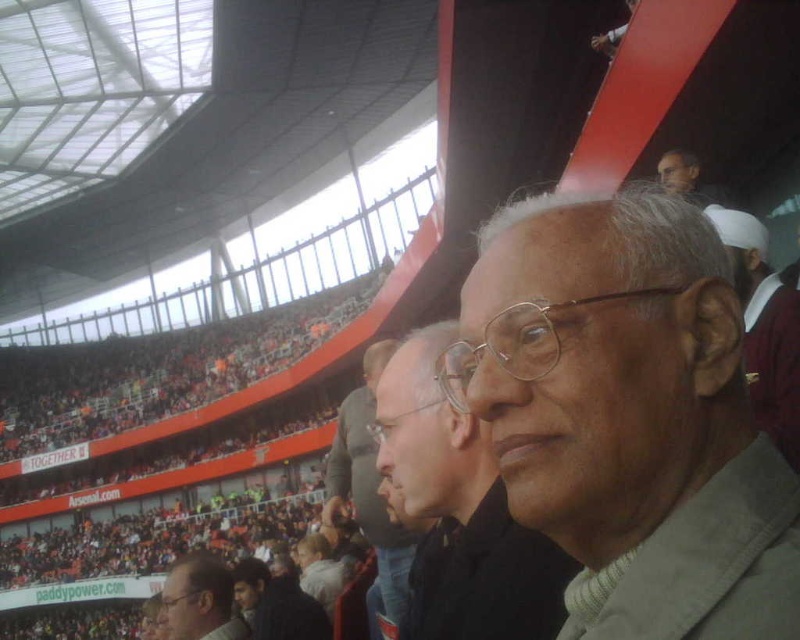
You are a photographer trying to capture a candid shot of the light brown leather jacket at center without including the gray woolen sweater at center in the frame. Given their positions, is this possible?

The gray woolen sweater at center is in front of the light brown leather jacket at center, so it would block the view. Therefore, it is not possible to capture the light brown leather jacket at center without the gray woolen sweater at center appearing in the frame.

You are standing in the stadium and want to move from point A to point B. Point A is at coordinates point (578, 634) and point B is at coordinates point (200, 584). Which point is closer to you when you start at point A?

Point A at coordinates point (578, 634) is closer to you than point B at coordinates point (200, 584) because the description states that point (578, 634) is closer to the viewer than point (200, 584).

You are standing in the stadium and want to take a photo. There are two points in the image you want to focus on, point (526, 397) and point (798, 419). Which point should you focus on first to ensure it appears clearer in your photo?

Point (526, 397) is closer to the viewer than point (798, 419), so focusing on point (526, 397) first will ensure it appears clearer in the photo.